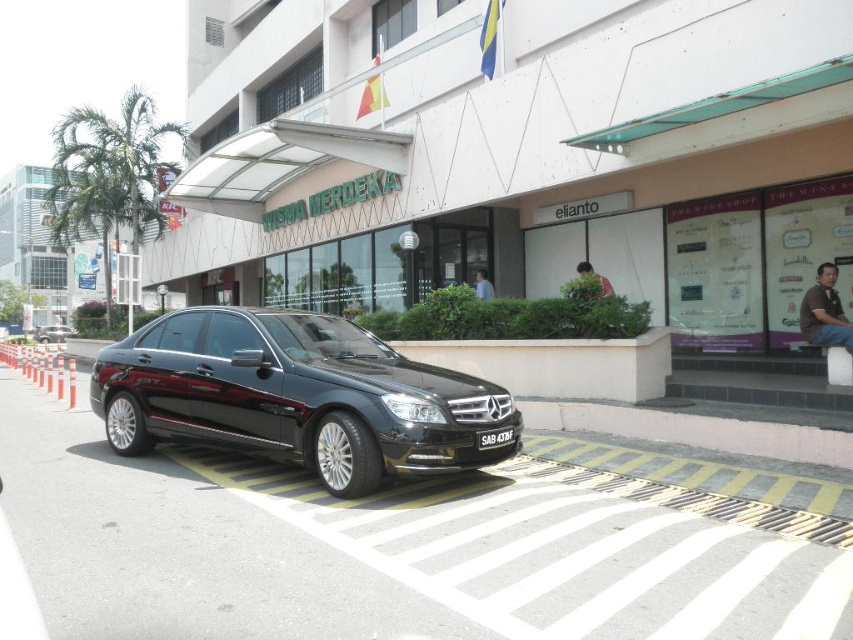
Question: Which point is farther to the camera?

Choices:
 (A) (595, 278)
 (B) (727, 193)

Answer: (B)

Question: Can you confirm if black metallic car at center is positioned below brown leather shirt at right?

Choices:
 (A) yes
 (B) no

Answer: (B)

Question: Which point appears farthest from the camera in this image?

Choices:
 (A) (482, 298)
 (B) (549, 8)
 (C) (398, 365)
 (D) (582, 268)

Answer: (A)

Question: In this image, where is shiny black sedan at center located relative to brown leather jacket at center?

Choices:
 (A) right
 (B) left

Answer: (B)

Question: Is brown leather shirt at right to the left of shiny black sedan at center from the viewer's perspective?

Choices:
 (A) yes
 (B) no

Answer: (B)

Question: Which point appears farthest from the camera in this image?

Choices:
 (A) (599, 284)
 (B) (126, 392)

Answer: (A)